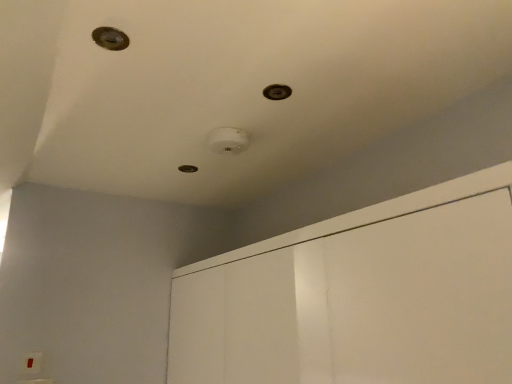
Question: Is metallic circular hole at center, which ranks as the 2th hole in left-to-right order, further to camera compared to white glossy dresser at upper center?

Choices:
 (A) no
 (B) yes

Answer: (B)

Question: Would you say metallic circular hole at center, placed as the 1th hole when sorted from back to front, is outside white glossy dresser at upper center?

Choices:
 (A) yes
 (B) no

Answer: (A)

Question: Can you confirm if metallic circular hole at center, which ranks as the 2th hole in left-to-right order, is wider than white glossy dresser at upper center?

Choices:
 (A) no
 (B) yes

Answer: (A)

Question: Is metallic circular hole at center, the third hole from the top, turned away from white glossy dresser at upper center?

Choices:
 (A) yes
 (B) no

Answer: (B)

Question: Can you confirm if metallic circular hole at center, placed as the 1th hole when sorted from back to front, is taller than white glossy dresser at upper center?

Choices:
 (A) yes
 (B) no

Answer: (B)

Question: In the image, is white glossy dresser at upper center on the left side or the right side of metallic circular hole at upper center, which is the second hole from top to bottom?

Choices:
 (A) right
 (B) left

Answer: (A)

Question: Relative to metallic circular hole at upper center, which is the 2th hole in front-to-back order, is white glossy dresser at upper center in front or behind?

Choices:
 (A) front
 (B) behind

Answer: (A)

Question: Which is correct: white glossy dresser at upper center is inside metallic circular hole at upper center, which is the second hole from top to bottom, or outside of it?

Choices:
 (A) outside
 (B) inside

Answer: (A)

Question: Is point (356, 375) closer or farther from the camera than point (269, 89)?

Choices:
 (A) closer
 (B) farther

Answer: (A)

Question: Do you think metallic circular hole at upper center, which appears as the first hole when viewed from the right, is within metallic circular hole at center, the 2th hole positioned from the right, or outside of it?

Choices:
 (A) outside
 (B) inside

Answer: (A)

Question: Is metallic circular hole at upper center, the second hole from the bottom, taller or shorter than metallic circular hole at center, placed as the 1th hole when sorted from back to front?

Choices:
 (A) short
 (B) tall

Answer: (A)

Question: Considering the positions of point (274, 94) and point (190, 172), is point (274, 94) closer or farther from the camera than point (190, 172)?

Choices:
 (A) closer
 (B) farther

Answer: (A)

Question: Based on their sizes in the image, would you say metallic circular hole at upper center, the second hole positioned from the back, is bigger or smaller than metallic circular hole at center, the first hole ordered from the bottom?

Choices:
 (A) small
 (B) big

Answer: (A)

Question: Looking at the image, does metallic circular hole at upper left, which is the third hole in back-to-front order, seem bigger or smaller compared to metallic circular hole at upper center, which is the 2th hole in front-to-back order?

Choices:
 (A) big
 (B) small

Answer: (A)

Question: Considering the positions of point (116, 41) and point (273, 89), is point (116, 41) closer or farther from the camera than point (273, 89)?

Choices:
 (A) farther
 (B) closer

Answer: (B)